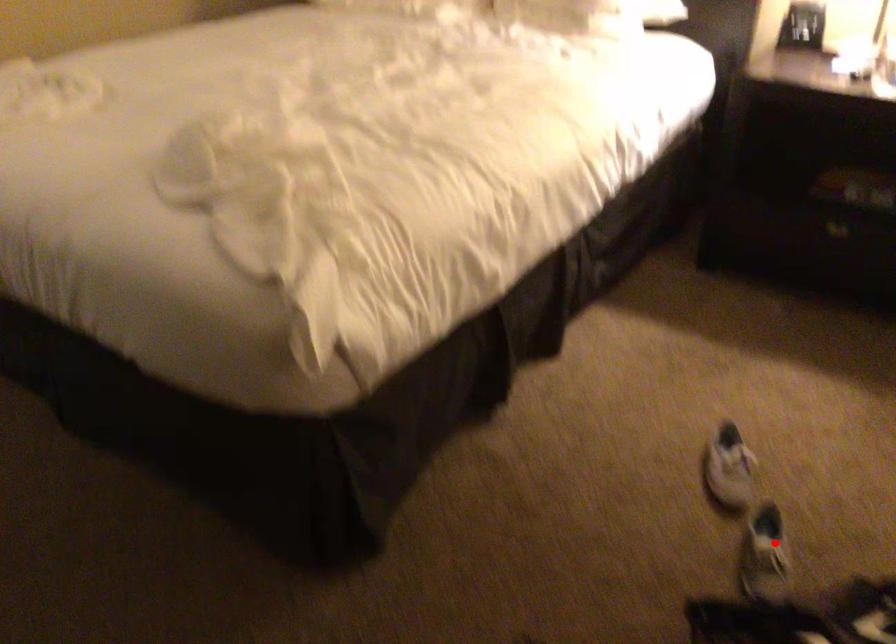
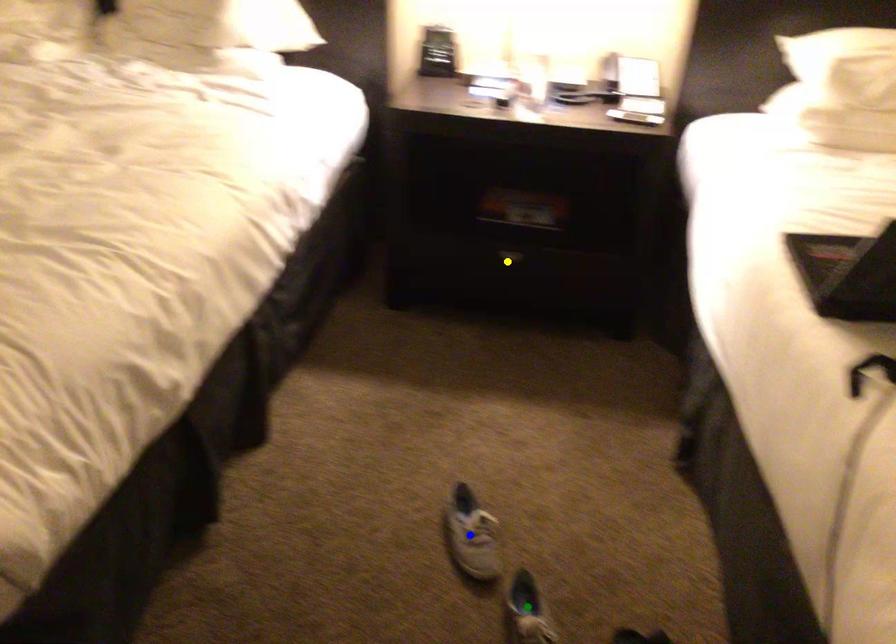
Question: I am providing you with two images of the same scene from different viewpoints. A red point is marked on the first image. You are given multiple points on the second image. Which mark in image 2 goes with the point in image 1?

Choices:
 (A) blue point
 (B) green point
 (C) yellow point

Answer: (B)